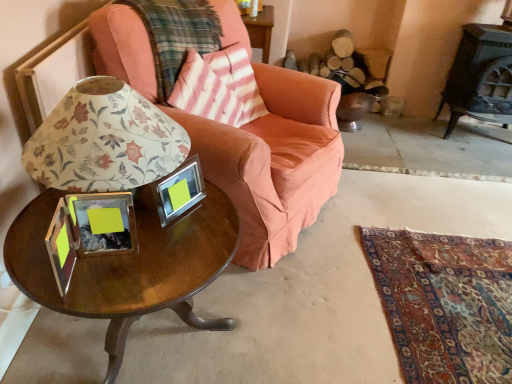
Where is `vacant point above shiny brown wood coffee table at lower left (from a real-world perspective)`? The height and width of the screenshot is (384, 512). vacant point above shiny brown wood coffee table at lower left (from a real-world perspective) is located at coordinates (153, 243).